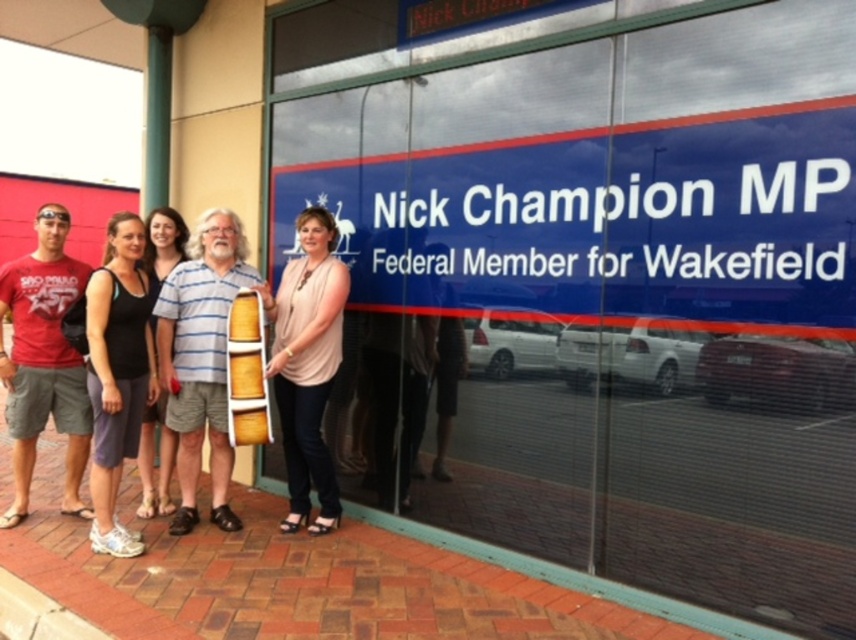
Question: Does pink fabric dress at center have a greater width compared to black fabric dress at center?

Choices:
 (A) no
 (B) yes

Answer: (B)

Question: Which of the following is the closest to the observer?

Choices:
 (A) pink fabric dress at center
 (B) black fabric dress at center
 (C) wooden barrel at center

Answer: (A)

Question: Which point is closer to the camera?

Choices:
 (A) (134, 339)
 (B) (49, 404)

Answer: (A)

Question: Does red cotton t-shirt at left have a smaller size compared to black fabric dress at center?

Choices:
 (A) no
 (B) yes

Answer: (A)

Question: Which of the following is the farthest from the observer?

Choices:
 (A) black fabric tank top at center
 (B) red cotton t-shirt at left
 (C) wooden barrel at center
 (D) black fabric dress at center

Answer: (D)

Question: In this image, where is red cotton t-shirt at left located relative to pink fabric dress at center?

Choices:
 (A) right
 (B) left

Answer: (B)